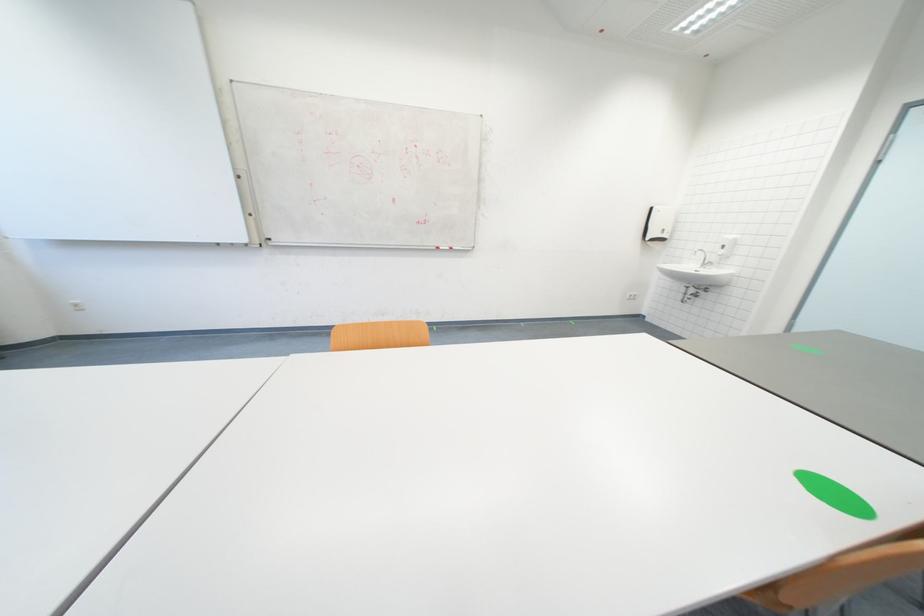
Find where to writ the red whiteboard marker. Please return your answer as a coordinate pair (x, y).

(444, 248)